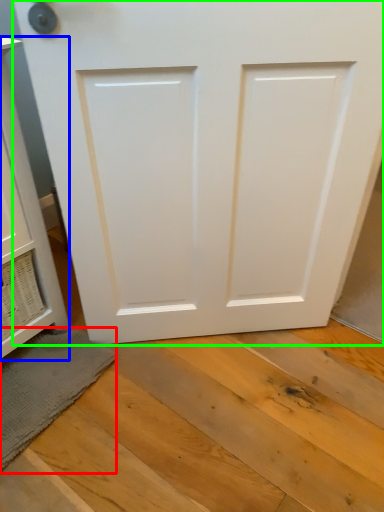
Question: Estimate the real-world distances between objects in this image. Which object is farther from bath mat (highlighted by a red box), cabinetry (highlighted by a blue box) or door (highlighted by a green box)?

Choices:
 (A) cabinetry
 (B) door

Answer: (B)